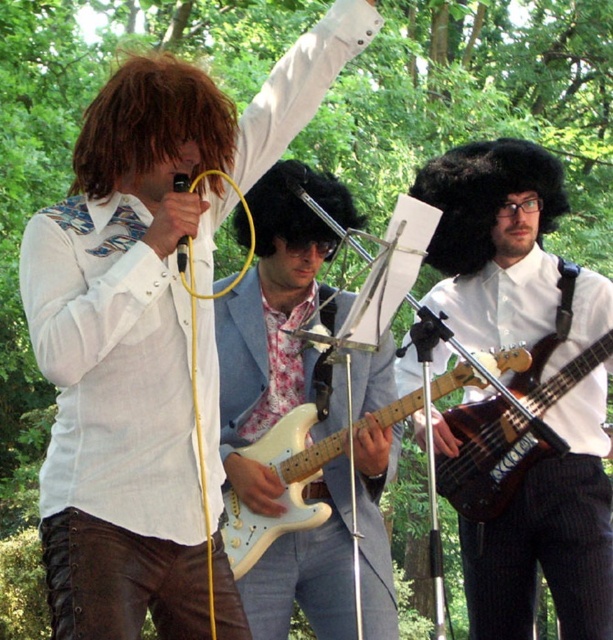
You are a photographer positioned behind the performers and want to capture both the matte white guitar at center and the shiny brown bass guitar at center in your shot. Which guitar will appear closer to the camera in the photo?

The matte white guitar at center will appear closer to the camera because it is positioned in front of the shiny brown bass guitar at center.

Consider the image. You are a photographer setting up for a closeup shot of the musical performance. You want to focus on the matte white guitar at center and the shiny brown bass guitar at center. Which guitar should you adjust your camera angle to look above to capture both?

The matte white guitar at center is positioned over the shiny brown bass guitar at center, so to capture both, adjust the camera angle to look above the matte white guitar at center.

You are a photographer positioned at the front of the stage. You want to capture a closeup shot of the curly brown hair at center. The camera you are using has a minimum focusing distance of 2 meters. Can you take the closeup without moving closer?

The curly brown hair at center is 2.54 meters away from the camera. Since the minimum focusing distance is 2 meters, the camera can focus on the curly brown hair at center because 2.54 meters is within the focusing range.